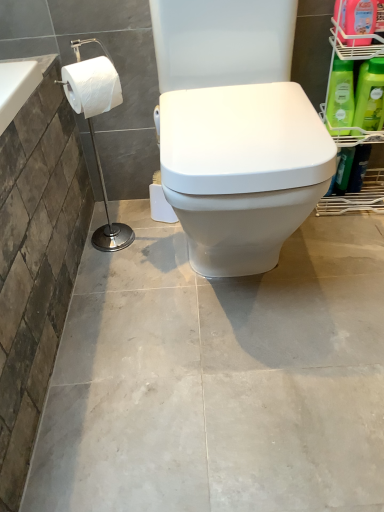
The image size is (384, 512). Identify the location of green matte bottle at upper right, placed as the 2th cleaning product when sorted from bottom to top. tap(340, 97).

What is the approximate height of green matte bottle at upper right, which is the second cleaning product from top to bottom?

green matte bottle at upper right, which is the second cleaning product from top to bottom, is 8.29 inches tall.

Find the location of `white matte toilet paper at left`. white matte toilet paper at left is located at coordinates (92, 86).

How many degrees apart are the facing directions of green plastic shelf at right and green matte bottle at right, the first cleaning product from the bottom?

0.919 degrees.

Where is `cleaning product that is the 2nd one when counting backward from the green plastic shelf at right`? This screenshot has width=384, height=512. cleaning product that is the 2nd one when counting backward from the green plastic shelf at right is located at coordinates (370, 95).

Considering the sizes of objects green plastic shelf at right and green matte bottle at right, the first cleaning product from the bottom, in the image provided, who is shorter, green plastic shelf at right or green matte bottle at right, the first cleaning product from the bottom,?

green matte bottle at right, the first cleaning product from the bottom, is shorter.

Which is in front, point (365, 33) or point (375, 117)?

Positioned in front is point (365, 33).

From a real-world perspective, which object rests below the other?

green plastic shelf at right.

Is green plastic shelf at right turned away from pink plastic bottle at upper right, acting as the 3th cleaning product starting from the bottom?

Yes, green plastic shelf at right is positioned with its back facing pink plastic bottle at upper right, acting as the 3th cleaning product starting from the bottom.

Are green plastic shelf at right and pink plastic bottle at upper right, acting as the 3th cleaning product starting from the bottom, far apart?

They are positioned close to each other.

Is green matte bottle at right, the first cleaning product from the bottom, touching white glossy toilet at center?

No, green matte bottle at right, the first cleaning product from the bottom, is not with white glossy toilet at center.

Is the depth of green matte bottle at right, the first cleaning product from the bottom, greater than that of white glossy toilet at center?

Yes, it is.

Considering the relative sizes of green matte bottle at right, the first cleaning product from the bottom, and white glossy toilet at center in the image provided, is green matte bottle at right, the first cleaning product from the bottom, wider than white glossy toilet at center?

No.

Is point (364, 114) closer or farther from the camera than point (178, 137)?

Point (364, 114) is farther from the camera than point (178, 137).

Where is `cleaning product below the green matte bottle at right, the first cleaning product from the bottom (from a real-world perspective)`? The width and height of the screenshot is (384, 512). cleaning product below the green matte bottle at right, the first cleaning product from the bottom (from a real-world perspective) is located at coordinates (340, 97).

Considering the relative sizes of green matte bottle at right, the first cleaning product from the bottom, and green matte bottle at upper right, placed as the 2th cleaning product when sorted from bottom to top, in the image provided, is green matte bottle at right, the first cleaning product from the bottom, thinner than green matte bottle at upper right, placed as the 2th cleaning product when sorted from bottom to top,?

No, green matte bottle at right, the first cleaning product from the bottom, is not thinner than green matte bottle at upper right, placed as the 2th cleaning product when sorted from bottom to top.

From the image's perspective, is green matte bottle at right, positioned as the third cleaning product in top-to-bottom order, above or below green matte bottle at upper right, placed as the 2th cleaning product when sorted from bottom to top?

green matte bottle at right, positioned as the third cleaning product in top-to-bottom order, is below green matte bottle at upper right, placed as the 2th cleaning product when sorted from bottom to top.

Looking at the image, does green matte bottle at right, the first cleaning product from the bottom, seem bigger or smaller compared to green matte bottle at upper right, placed as the 2th cleaning product when sorted from bottom to top?

Considering their sizes, green matte bottle at right, the first cleaning product from the bottom, takes up more space than green matte bottle at upper right, placed as the 2th cleaning product when sorted from bottom to top.

Based on the photo, can we say pink plastic bottle at upper right, acting as the 3th cleaning product starting from the bottom, lies outside white paper towel at left?

Absolutely, pink plastic bottle at upper right, acting as the 3th cleaning product starting from the bottom, is external to white paper towel at left.

From a real-world perspective, is pink plastic bottle at upper right, the first cleaning product in the top-to-bottom sequence, positioned under white paper towel at left based on gravity?

No.

Considering the relative sizes of pink plastic bottle at upper right, acting as the 3th cleaning product starting from the bottom, and white paper towel at left in the image provided, is pink plastic bottle at upper right, acting as the 3th cleaning product starting from the bottom, shorter than white paper towel at left?

Yes, pink plastic bottle at upper right, acting as the 3th cleaning product starting from the bottom, is shorter than white paper towel at left.

Looking at this image, is pink plastic bottle at upper right, acting as the 3th cleaning product starting from the bottom, facing towards white paper towel at left?

No, pink plastic bottle at upper right, acting as the 3th cleaning product starting from the bottom, does not turn towards white paper towel at left.

Is white glossy toilet at center inside the boundaries of green plastic shelf at right, or outside?

white glossy toilet at center is not enclosed by green plastic shelf at right.

Between white glossy toilet at center and green plastic shelf at right, which one has more height?

With more height is white glossy toilet at center.

From a real-world perspective, which object rests below the other?

green plastic shelf at right is physically lower.

At what (x,y) coordinates should I click in order to perform the action: click on toilet on the left side of green plastic shelf at right. Please return your answer as a coordinate pair (x, y). The image size is (384, 512). Looking at the image, I should click on (236, 131).

How different are the orientations of white glossy toilet at center and pink plastic bottle at upper right, the first cleaning product in the top-to-bottom sequence, in degrees?

They differ by 0.0563 degrees in their facing directions.

Considering the relative sizes of white glossy toilet at center and pink plastic bottle at upper right, the first cleaning product in the top-to-bottom sequence, in the image provided, is white glossy toilet at center thinner than pink plastic bottle at upper right, the first cleaning product in the top-to-bottom sequence,?

No.

Are white glossy toilet at center and pink plastic bottle at upper right, the first cleaning product in the top-to-bottom sequence, far apart?

No, there isn't a large distance between white glossy toilet at center and pink plastic bottle at upper right, the first cleaning product in the top-to-bottom sequence.

Is white glossy toilet at center outside of pink plastic bottle at upper right, the first cleaning product in the top-to-bottom sequence?

Answer: That's correct, white glossy toilet at center is outside of pink plastic bottle at upper right, the first cleaning product in the top-to-bottom sequence.

Identify the location of shelf in front of the green matte bottle at right, positioned as the third cleaning product in top-to-bottom order. Image resolution: width=384 pixels, height=512 pixels. (357, 198).

Starting from the green plastic shelf at right, which cleaning product is the 1st one behind? Please provide its 2D coordinates.

[(356, 16)]

Considering their positions, is green matte bottle at upper right, placed as the 2th cleaning product when sorted from bottom to top, positioned further to white paper towel at left than white matte toilet paper at left?

green matte bottle at upper right, placed as the 2th cleaning product when sorted from bottom to top.

Which object lies further to the anchor point white glossy toilet at center, white matte toilet paper at left or white paper towel at left?

white paper towel at left lies further to white glossy toilet at center than the other object.

When comparing their distances from green matte bottle at upper right, placed as the 2th cleaning product when sorted from bottom to top, does pink plastic bottle at upper right, acting as the 3th cleaning product starting from the bottom, or white paper towel at left seem further?

white paper towel at left is further to green matte bottle at upper right, placed as the 2th cleaning product when sorted from bottom to top.

Consider the image. Estimate the real-world distances between objects in this image. Which object is further from white paper towel at left, green matte bottle at upper right, placed as the 2th cleaning product when sorted from bottom to top, or green matte bottle at right, the first cleaning product from the bottom?

Among the two, green matte bottle at right, the first cleaning product from the bottom, is located further to white paper towel at left.

When comparing their distances from pink plastic bottle at upper right, the first cleaning product in the top-to-bottom sequence, does white paper towel at left or white matte toilet paper at left seem further?

Among the two, white matte toilet paper at left is located further to pink plastic bottle at upper right, the first cleaning product in the top-to-bottom sequence.

When comparing their distances from green matte bottle at upper right, placed as the 2th cleaning product when sorted from bottom to top, does white paper towel at left or white glossy toilet at center seem closer?

white glossy toilet at center lies closer to green matte bottle at upper right, placed as the 2th cleaning product when sorted from bottom to top, than the other object.

Estimate the real-world distances between objects in this image. Which object is closer to white paper towel at left, pink plastic bottle at upper right, the first cleaning product in the top-to-bottom sequence, or green plastic shelf at right?

Based on the image, pink plastic bottle at upper right, the first cleaning product in the top-to-bottom sequence, appears to be nearer to white paper towel at left.

Considering their positions, is green matte bottle at right, positioned as the third cleaning product in top-to-bottom order, positioned further to green plastic shelf at right than white matte toilet paper at left?

The object further to green plastic shelf at right is white matte toilet paper at left.

Identify the location of toilet between white paper towel at left and green matte bottle at upper right, placed as the 2th cleaning product when sorted from bottom to top, from left to right. (236, 131).

Where is `toilet between white paper towel at left and green plastic shelf at right from left to right`? This screenshot has width=384, height=512. toilet between white paper towel at left and green plastic shelf at right from left to right is located at coordinates (236, 131).

Image resolution: width=384 pixels, height=512 pixels. Find the location of `cleaning product between white glossy toilet at center and green matte bottle at right, the first cleaning product from the bottom, from front to back`. cleaning product between white glossy toilet at center and green matte bottle at right, the first cleaning product from the bottom, from front to back is located at coordinates (356, 16).

Locate an element on the screen. This screenshot has height=512, width=384. toilet between white matte toilet paper at left and pink plastic bottle at upper right, acting as the 3th cleaning product starting from the bottom, from left to right is located at coordinates (236, 131).